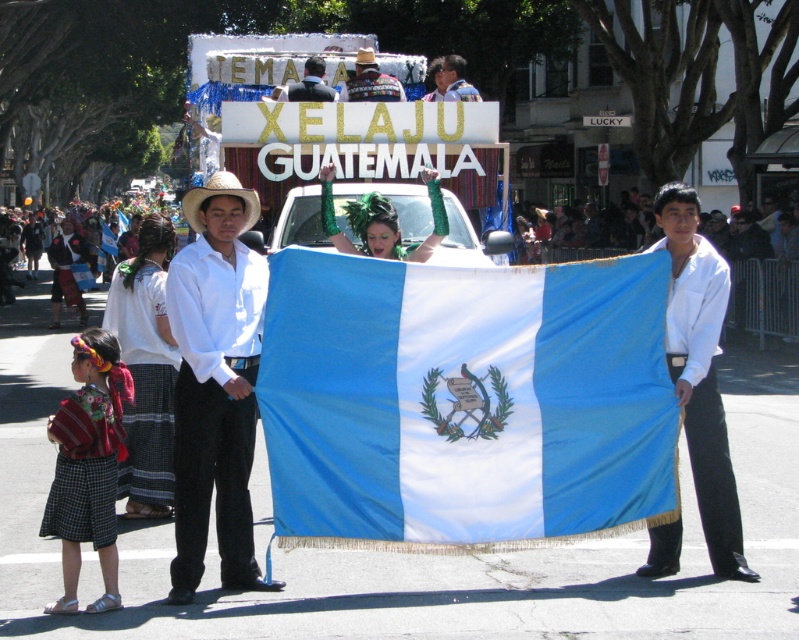
Question: Does embroidered cotton skirt at lower left have a larger size compared to knitted sweater at center?

Choices:
 (A) no
 (B) yes

Answer: (A)

Question: Is blue fabric flag at center in front of knitted sweater at center?

Choices:
 (A) yes
 (B) no

Answer: (A)

Question: Which point is closer to the camera?

Choices:
 (A) (332, 99)
 (B) (66, 275)
 (C) (132, 294)
 (D) (423, 252)

Answer: (D)

Question: Which object is positioned closest to the strawhat at left?

Choices:
 (A) blue fabric flag at center
 (B) white cotton shirt at center
 (C) matte black suit at upper center
 (D) matte white shirt at center

Answer: (B)

Question: Which point appears closest to the camera in this image?

Choices:
 (A) (237, 184)
 (B) (372, 202)
 (C) (165, 340)

Answer: (A)

Question: Does white cotton shirt at center appear under embroidered fabric dress at lower left?

Choices:
 (A) no
 (B) yes

Answer: (B)